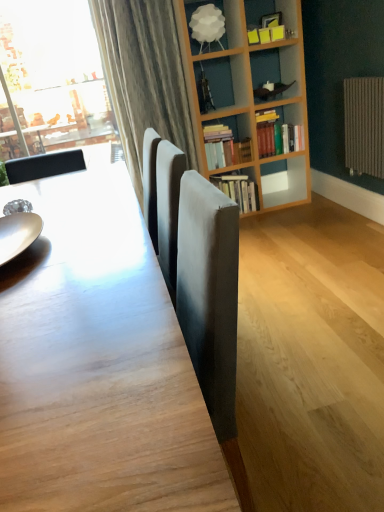
Question: Is slightly worn paper book at center, which is the third book from top to bottom, positioned beyond the bounds of shiny silver plate at left?

Choices:
 (A) yes
 (B) no

Answer: (A)

Question: Is slightly worn paper book at center, the first book from the bottom, taller than shiny silver plate at left?

Choices:
 (A) no
 (B) yes

Answer: (B)

Question: Considering the relative sizes of slightly worn paper book at center, the first book from the bottom, and shiny silver plate at left in the image provided, is slightly worn paper book at center, the first book from the bottom, shorter than shiny silver plate at left?

Choices:
 (A) no
 (B) yes

Answer: (A)

Question: Is slightly worn paper book at center, the first book from the bottom, further to camera compared to shiny silver plate at left?

Choices:
 (A) yes
 (B) no

Answer: (A)

Question: From a real-world perspective, is slightly worn paper book at center, which is the third book from top to bottom, below shiny silver plate at left?

Choices:
 (A) yes
 (B) no

Answer: (A)

Question: In terms of size, does hardcover books at center, which ranks as the third book in bottom-to-top order, appear bigger or smaller than shiny silver plate at left?

Choices:
 (A) big
 (B) small

Answer: (A)

Question: In the image, is hardcover books at center, which ranks as the third book in bottom-to-top order, positioned in front of or behind shiny silver plate at left?

Choices:
 (A) behind
 (B) front

Answer: (A)

Question: From a real-world perspective, is hardcover books at center, arranged as the first book when viewed from the top, physically located above or below shiny silver plate at left?

Choices:
 (A) below
 (B) above

Answer: (A)

Question: In terms of height, does hardcover books at center, which ranks as the third book in bottom-to-top order, look taller or shorter compared to shiny silver plate at left?

Choices:
 (A) short
 (B) tall

Answer: (B)

Question: From their relative heights in the image, would you say shiny silver plate at left is taller or shorter than wooden table at center?

Choices:
 (A) tall
 (B) short

Answer: (B)

Question: In terms of width, does shiny silver plate at left look wider or thinner when compared to wooden table at center?

Choices:
 (A) wide
 (B) thin

Answer: (B)

Question: Is point (31, 238) closer or farther from the camera than point (13, 480)?

Choices:
 (A) farther
 (B) closer

Answer: (A)

Question: Is shiny silver plate at left to the left or to the right of wooden table at center in the image?

Choices:
 (A) right
 (B) left

Answer: (B)

Question: In terms of size, does hardcover books at upper right, the second book from the bottom, appear bigger or smaller than slightly worn paper book at center, which is the third book from top to bottom?

Choices:
 (A) big
 (B) small

Answer: (B)

Question: Is hardcover books at upper right, the second book from the top, situated inside slightly worn paper book at center, the first book from the bottom, or outside?

Choices:
 (A) inside
 (B) outside

Answer: (B)